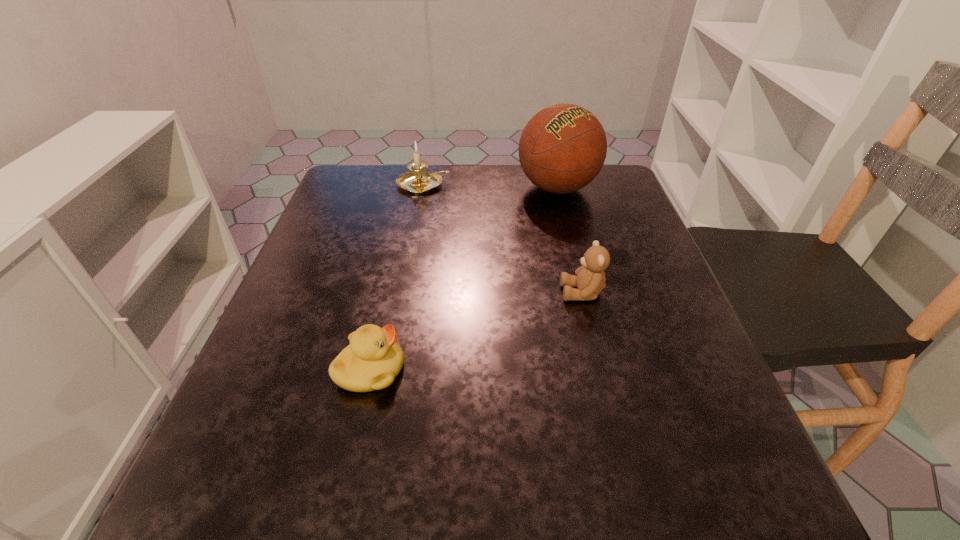
I want to click on the tallest object, so click(x=563, y=147).

This screenshot has height=540, width=960. Identify the location of candle holder. (415, 182).

In order to click on the third farthest object in this screenshot , I will do `click(590, 280)`.

Locate an element on the screen. The width and height of the screenshot is (960, 540). the nearest object is located at coordinates (372, 360).

This screenshot has height=540, width=960. Find the location of `duckling`. duckling is located at coordinates (372, 360).

You are a GUI agent. You are given a task and a screenshot of the screen. Output one action in this format:
    pyautogui.click(x=<x>, y=<y>)
    Task: Click on the blank space located on the front of the tallest object
    This screenshot has width=960, height=540.
    Given the screenshot: What is the action you would take?
    pyautogui.click(x=575, y=261)

Identify the location of free point located on the handle side of the candle holder. pyautogui.click(x=604, y=185).

Locate an element on the screen. This screenshot has height=540, width=960. free space located 0.160m on the face of the second nearest object is located at coordinates (478, 293).

Where is `free region located 0.250m on the face of the second nearest object`? This screenshot has height=540, width=960. free region located 0.250m on the face of the second nearest object is located at coordinates (431, 293).

The width and height of the screenshot is (960, 540). I want to click on vacant space located on the face of the second nearest object, so click(x=353, y=293).